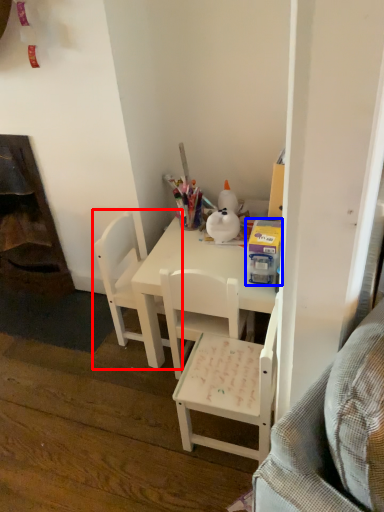
Question: Among these objects, which one is farthest to the camera, chair (highlighted by a red box) or box (highlighted by a blue box)?

Choices:
 (A) chair
 (B) box

Answer: (A)